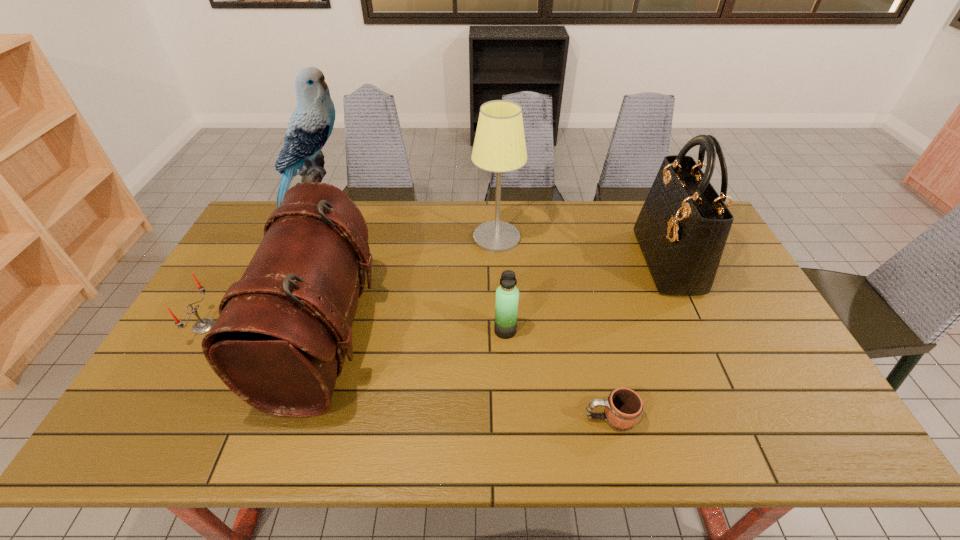
This screenshot has width=960, height=540. What are the coordinates of `free space located on the right of the table lamp` in the screenshot? It's located at 557,238.

In order to click on vacant region located 0.300m at the front of the rightmost object with visible charms in this screenshot , I will do `click(550, 261)`.

The width and height of the screenshot is (960, 540). Identify the location of vacant space situated at the front of the rightmost object with visible charms. (578, 261).

You are a GUI agent. You are given a task and a screenshot of the screen. Output one action in this format:
    pyautogui.click(x=<x>, y=<y>)
    Task: Click on the vacant space located at the front of the rightmost object with visible charms
    Image resolution: width=960 pixels, height=540 pixels.
    Given the screenshot: What is the action you would take?
    pyautogui.click(x=578, y=261)

In order to click on vacant area situated on the front-facing side of the satchel in this screenshot , I will do `click(516, 336)`.

At what (x,y) coordinates should I click in order to perform the action: click on vacant area situated on the front of the third shortest object. Please return your answer as a coordinate pair (x, y). Looking at the image, I should click on (507, 354).

I want to click on free space located 0.050m on the front-facing side of the leftmost object, so click(x=232, y=326).

Find the location of a particular element. This screenshot has width=960, height=540. free space located on the side of the shortest object with the handle is located at coordinates (493, 418).

Where is `blank area located 0.280m on the side of the shortest object with the handle`? The image size is (960, 540). blank area located 0.280m on the side of the shortest object with the handle is located at coordinates (463, 418).

Where is `free region located 0.350m on the side of the shortest object with the handle`? free region located 0.350m on the side of the shortest object with the handle is located at coordinates pos(433,418).